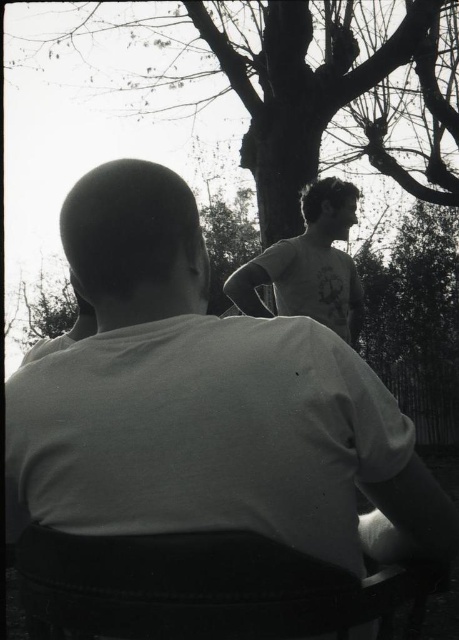
Is the position of black fabric chair at lower center less distant than that of white cotton t-shirt at upper right?

That is True.

Does point (51, 573) come farther from viewer compared to point (332, 282)?

No.

Where is `black fabric chair at lower center`? Image resolution: width=459 pixels, height=640 pixels. black fabric chair at lower center is located at coordinates (197, 586).

Does bare branches at upper center have a smaller size compared to white cotton t-shirt at upper right?

Incorrect, bare branches at upper center is not smaller in size than white cotton t-shirt at upper right.

Who is higher up, bare branches at upper center or white cotton t-shirt at upper right?

Positioned higher is bare branches at upper center.

Identify the location of bare branches at upper center. (190, 67).

Locate an element on the screen. The height and width of the screenshot is (640, 459). bare branches at upper center is located at coordinates (190, 67).

Is bare branches at upper center wider than black fabric chair at lower center?

Yes, bare branches at upper center is wider than black fabric chair at lower center.

How distant is bare branches at upper center from black fabric chair at lower center?

bare branches at upper center and black fabric chair at lower center are 24.97 feet apart from each other.

In order to click on bare branches at upper center in this screenshot , I will do `click(190, 67)`.

You are a GUI agent. You are given a task and a screenshot of the screen. Output one action in this format:
    pyautogui.click(x=<x>, y=<y>)
    Task: Click on the bare branches at upper center
    Image resolution: width=459 pixels, height=640 pixels.
    Given the screenshot: What is the action you would take?
    pyautogui.click(x=190, y=67)